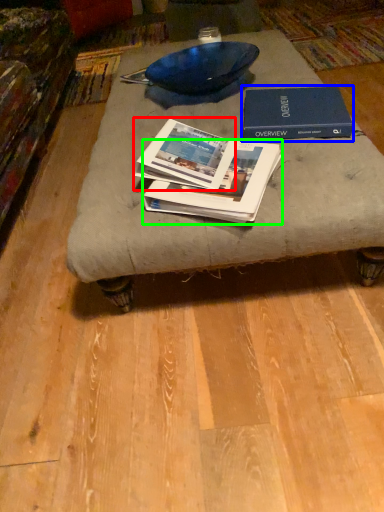
Question: Estimate the real-world distances between objects in this image. Which object is farther from book (highlighted by a red box), book (highlighted by a blue box) or book (highlighted by a green box)?

Choices:
 (A) book
 (B) book

Answer: (A)